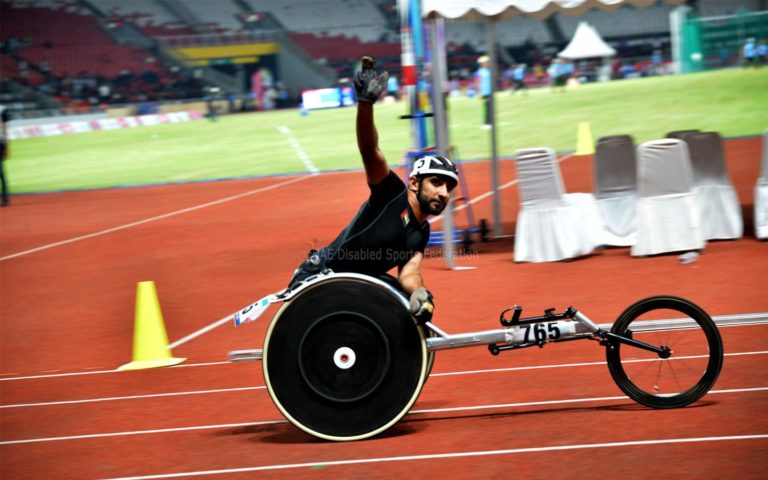
Locate an element on the screen. Image resolution: width=768 pixels, height=480 pixels. chair is located at coordinates (555, 213).